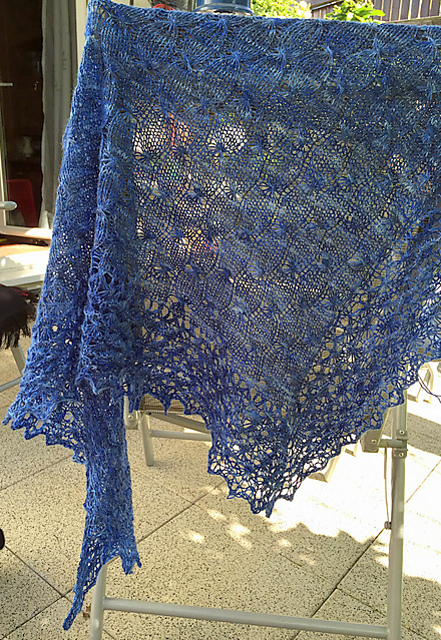
At what (x,y) coordinates should I click in order to perform the action: click on tile. Please return your answer as a coordinate pair (x, y). Looking at the image, I should click on (49, 452).